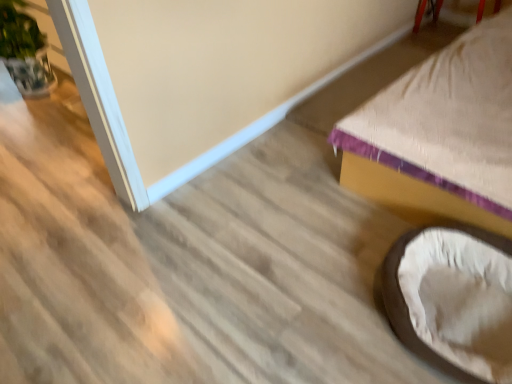
Question: From a real-world perspective, relative to green leafy plant at left, is soft beige fabric bean bag chair at lower right vertically above or below?

Choices:
 (A) above
 (B) below

Answer: (B)

Question: Is soft beige fabric bean bag chair at lower right to the left or to the right of green leafy plant at left in the image?

Choices:
 (A) right
 (B) left

Answer: (A)

Question: Estimate the real-world distances between objects in this image. Which object is farther from the soft beige fabric bean bag chair at lower right?

Choices:
 (A) green leafy plant at left
 (B) beige fabric bed at lower right

Answer: (A)

Question: Estimate the real-world distances between objects in this image. Which object is farther from the beige fabric bed at lower right?

Choices:
 (A) green leafy plant at left
 (B) soft beige fabric bean bag chair at lower right

Answer: (A)